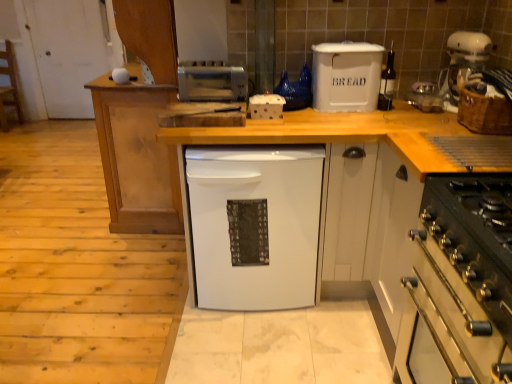
Question: Is white plastic bread bin at upper center positioned far away from clear plastic container at upper right, the 4th appliance viewed from the left?

Choices:
 (A) yes
 (B) no

Answer: (B)

Question: Could you tell me if white plastic bread bin at upper center is facing clear plastic container at upper right, the 4th appliance viewed from the left?

Choices:
 (A) yes
 (B) no

Answer: (B)

Question: Can you confirm if white plastic bread bin at upper center is positioned to the left of clear plastic container at upper right, which is the first appliance in right-to-left order?

Choices:
 (A) no
 (B) yes

Answer: (B)

Question: From a real-world perspective, is white plastic bread bin at upper center physically below clear plastic container at upper right, which is the first appliance in right-to-left order?

Choices:
 (A) yes
 (B) no

Answer: (B)

Question: Is the position of white plastic bread bin at upper center more distant than that of clear plastic container at upper right, which is the first appliance in right-to-left order?

Choices:
 (A) no
 (B) yes

Answer: (A)

Question: Considering the relative sizes of white plastic bread bin at upper center and clear plastic container at upper right, which is the first appliance in right-to-left order, in the image provided, is white plastic bread bin at upper center wider than clear plastic container at upper right, which is the first appliance in right-to-left order,?

Choices:
 (A) no
 (B) yes

Answer: (A)

Question: Would you say clear plastic container at upper right, the 4th appliance viewed from the left, is part of matte white wine bottle at center, acting as the 3th appliance starting from the left,'s contents?

Choices:
 (A) yes
 (B) no

Answer: (B)

Question: Considering the relative sizes of matte white wine bottle at center, acting as the 3th appliance starting from the left, and clear plastic container at upper right, the 4th appliance viewed from the left, in the image provided, is matte white wine bottle at center, acting as the 3th appliance starting from the left, shorter than clear plastic container at upper right, the 4th appliance viewed from the left,?

Choices:
 (A) no
 (B) yes

Answer: (A)

Question: From a real-world perspective, is matte white wine bottle at center, acting as the 3th appliance starting from the left, physically below clear plastic container at upper right, the 4th appliance viewed from the left?

Choices:
 (A) yes
 (B) no

Answer: (B)

Question: Is matte white wine bottle at center, acting as the 3th appliance starting from the left, taller than clear plastic container at upper right, the 4th appliance viewed from the left?

Choices:
 (A) yes
 (B) no

Answer: (A)

Question: Is matte white wine bottle at center, acting as the 3th appliance starting from the left, smaller than clear plastic container at upper right, the 4th appliance viewed from the left?

Choices:
 (A) no
 (B) yes

Answer: (B)

Question: Is matte white wine bottle at center, acting as the 3th appliance starting from the left, oriented towards clear plastic container at upper right, which is the first appliance in right-to-left order?

Choices:
 (A) yes
 (B) no

Answer: (B)

Question: Is clear plastic container at upper right, which is the first appliance in right-to-left order, wider than satin silver toaster at upper center, acting as the first appliance starting from the left?

Choices:
 (A) no
 (B) yes

Answer: (B)